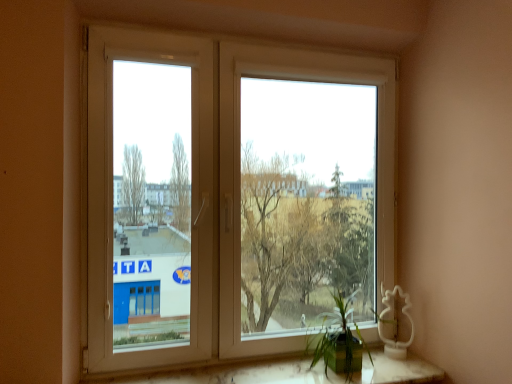
Question: From the image's perspective, is white marble window sill at lower center located above or below white plastic window at left?

Choices:
 (A) below
 (B) above

Answer: (A)

Question: From a real-world perspective, is white marble window sill at lower center positioned above or below white plastic window at left?

Choices:
 (A) below
 (B) above

Answer: (A)

Question: Considering the real-world distances, which object is closest to the white plastic window at center?

Choices:
 (A) white plastic window at left
 (B) green matte plant at lower right
 (C) white marble window sill at lower center

Answer: (A)

Question: Estimate the real-world distances between objects in this image. Which object is farther from the white marble window sill at lower center?

Choices:
 (A) green matte plant at lower right
 (B) white plastic window at left
 (C) white plastic window at center

Answer: (C)